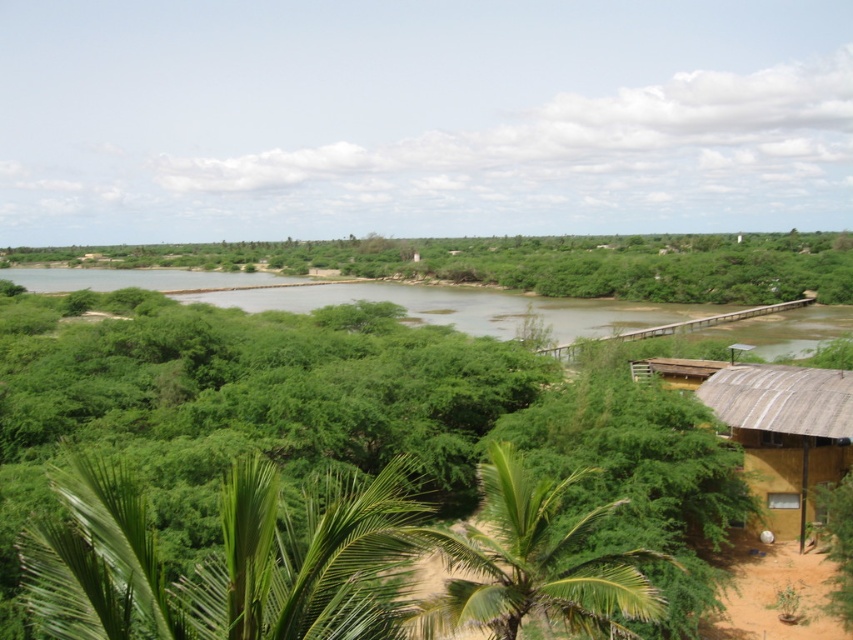
Is green leafy palm tree at lower center further to camera compared to brown corrugated metal hut at lower right?

No, green leafy palm tree at lower center is closer to the viewer.

Is green leafy palm tree at lower center positioned in front of brown corrugated metal hut at lower right?

Yes, green leafy palm tree at lower center is in front of brown corrugated metal hut at lower right.

Is point (637, 572) closer to camera compared to point (809, 486)?

Yes, point (637, 572) is closer to viewer.

At what (x,y) coordinates should I click in order to perform the action: click on green leafy palm tree at lower center. Please return your answer as a coordinate pair (x, y). Image resolution: width=853 pixels, height=640 pixels. Looking at the image, I should click on (531, 564).

This screenshot has width=853, height=640. In order to click on green leafy jungle at center in this screenshot , I will do `click(326, 417)`.

Is green leafy jungle at center bigger than brown corrugated metal hut at lower right?

Yes, green leafy jungle at center is bigger than brown corrugated metal hut at lower right.

This screenshot has height=640, width=853. I want to click on green leafy jungle at center, so click(326, 417).

Is green leafy jungle at center taller than green leafy palm tree at lower center?

Correct, green leafy jungle at center is much taller as green leafy palm tree at lower center.

Who is shorter, green leafy jungle at center or green leafy palm tree at lower center?

With less height is green leafy palm tree at lower center.

Measure the distance between green leafy jungle at center and camera.

green leafy jungle at center is 18.02 meters from camera.

Where is `green leafy jungle at center`? The image size is (853, 640). green leafy jungle at center is located at coordinates (326, 417).